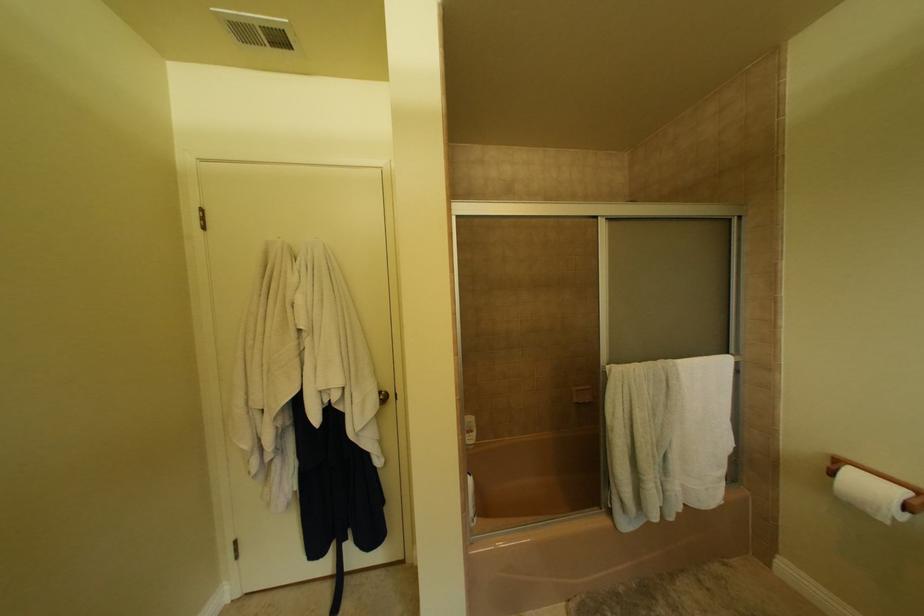
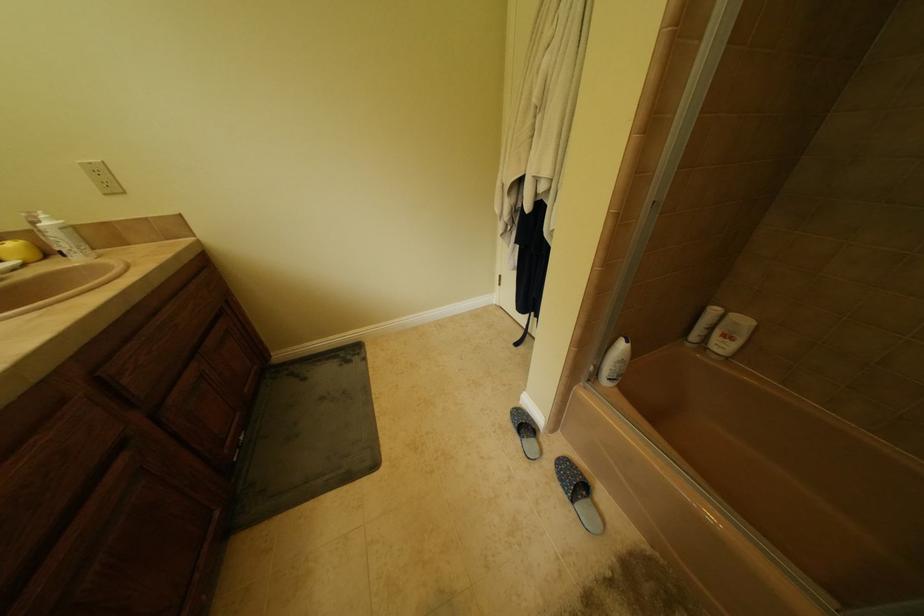
The images are taken continuously from a first-person perspective. In which direction is your viewpoint rotating?

The camera rotated toward left-down.